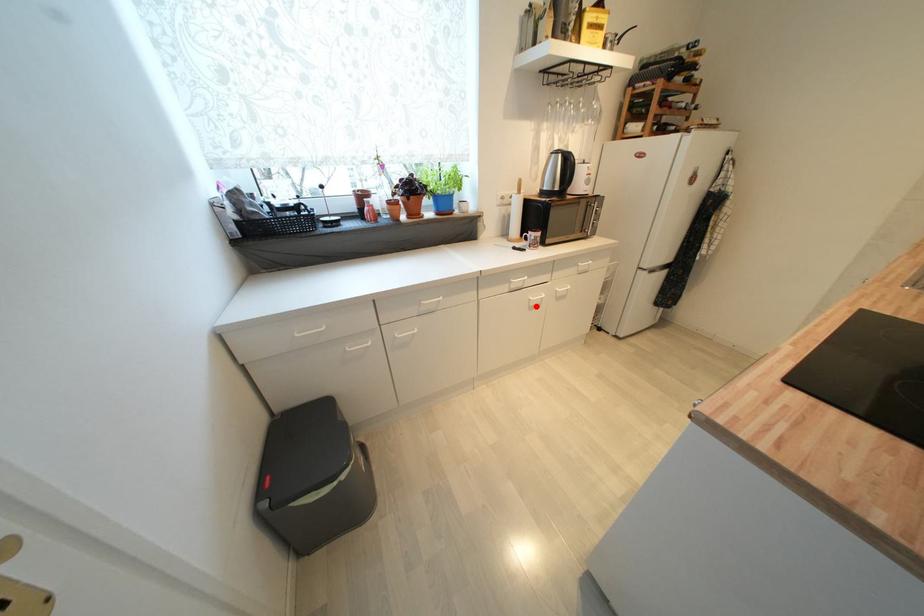
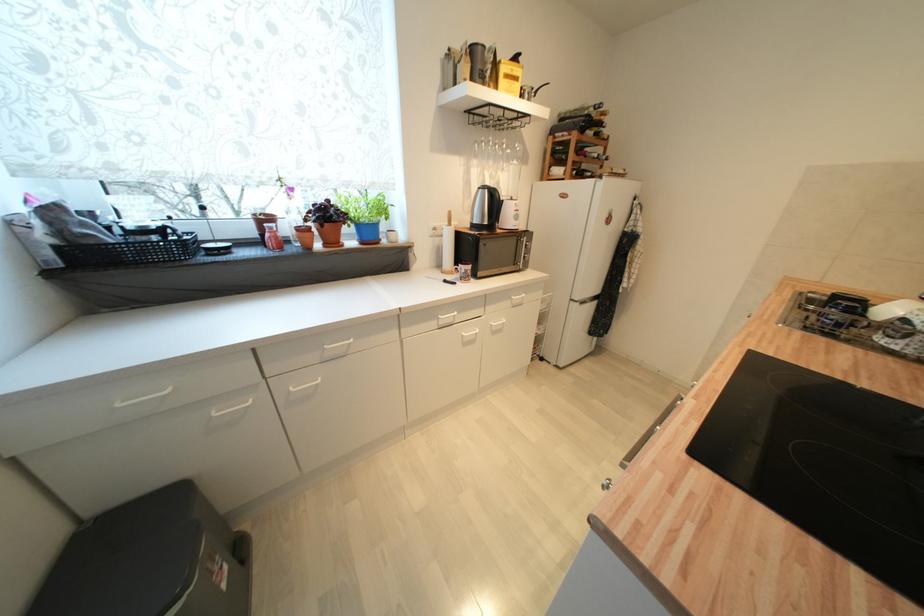
Find the pixel in the second image that matches the highlighted location in the first image.

(469, 342)